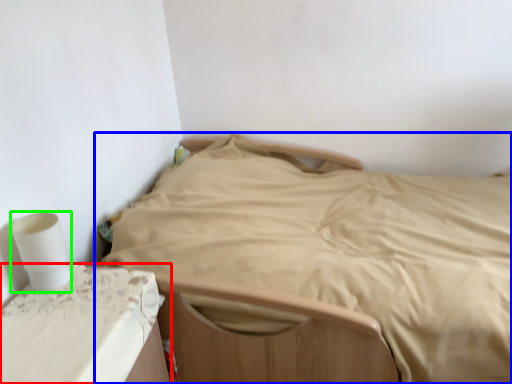
Question: Estimate the real-world distances between objects in this image. Which object is closer to furniture (highlighted by a red box), bed (highlighted by a blue box) or toilet paper (highlighted by a green box)?

Choices:
 (A) bed
 (B) toilet paper

Answer: (B)